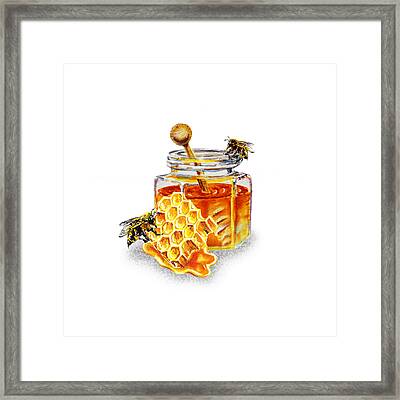
The height and width of the screenshot is (400, 400). In order to click on frame sides in this screenshot , I will do coord(209,10), coord(393,258), coord(15,273), coord(158,386).